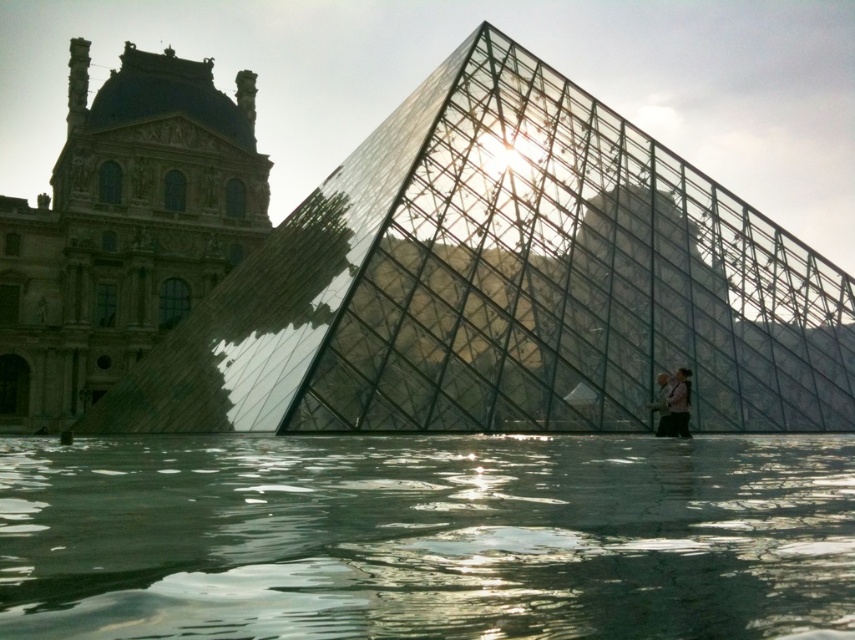
Question: Which object is farther from the camera taking this photo?

Choices:
 (A) transparent glass pyramid at center
 (B) light brown leather jacket at lower right
 (C) transparent glass water at center
 (D) pink fabric person at lower right

Answer: (D)

Question: Can you confirm if transparent glass pyramid at center is positioned to the right of light brown leather jacket at lower right?

Choices:
 (A) yes
 (B) no

Answer: (B)

Question: Does light brown leather jacket at lower right have a lesser width compared to pink fabric person at lower right?

Choices:
 (A) yes
 (B) no

Answer: (B)

Question: Which object is farther from the camera taking this photo?

Choices:
 (A) pink fabric person at lower right
 (B) light brown leather jacket at lower right
 (C) transparent glass water at center

Answer: (A)

Question: Does transparent glass water at center appear on the left side of pink fabric person at lower right?

Choices:
 (A) yes
 (B) no

Answer: (A)

Question: Estimate the real-world distances between objects in this image. Which object is farther from the pink fabric person at lower right?

Choices:
 (A) transparent glass pyramid at center
 (B) light brown leather jacket at lower right
 (C) transparent glass water at center

Answer: (C)